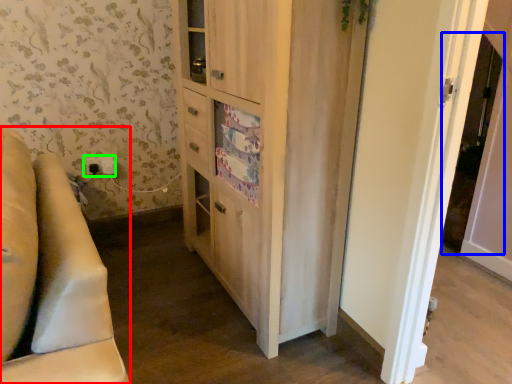
Question: Estimate the real-world distances between objects in this image. Which object is farther from furniture (highlighted by a red box), screen door (highlighted by a blue box) or electric outlet (highlighted by a green box)?

Choices:
 (A) screen door
 (B) electric outlet

Answer: (A)